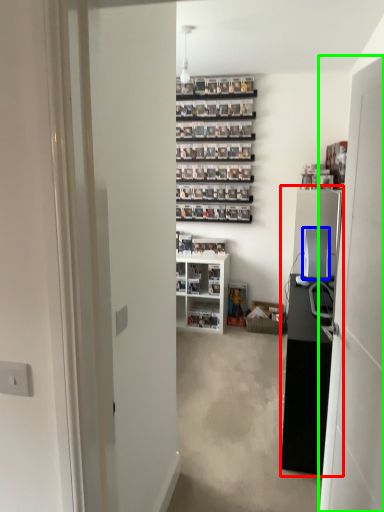
Question: Which object is the closest to the entertainment center (highlighted by a red box)? Choose among these: appliance (highlighted by a blue box) or door (highlighted by a green box).

Choices:
 (A) appliance
 (B) door

Answer: (A)